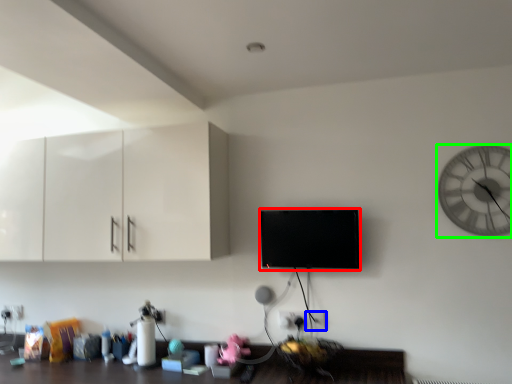
Question: Based on their relative distances, which object is nearer to flat (highlighted by a red box)? Choose from electric outlet (highlighted by a blue box) and wall clock (highlighted by a green box).

Choices:
 (A) electric outlet
 (B) wall clock

Answer: (A)